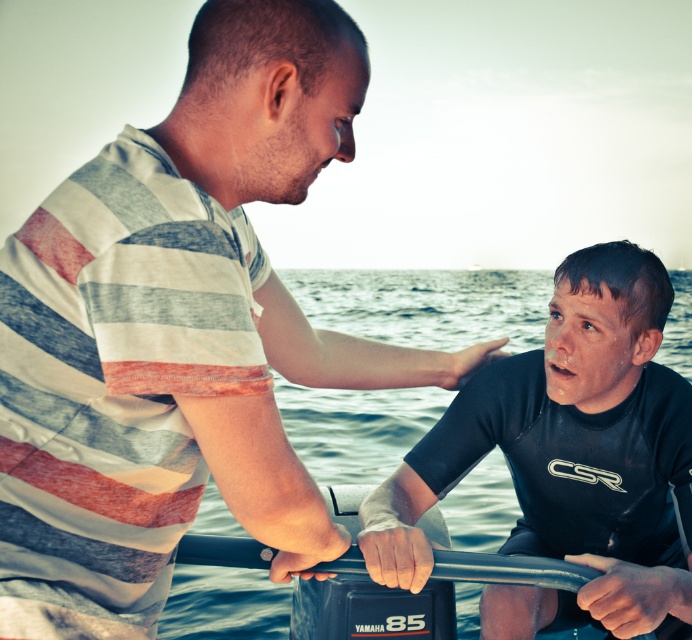
Who is taller, striped cotton shirt at upper left or clear blue water at lower center?

clear blue water at lower center

You are a GUI agent. You are given a task and a screenshot of the screen. Output one action in this format:
    pyautogui.click(x=<x>, y=<y>)
    Task: Click on the striped cotton shirt at upper left
    The image size is (692, 640).
    Given the screenshot: What is the action you would take?
    pyautogui.click(x=176, y=332)

Does striped cotton shirt at upper left have a larger size compared to black matte wetsuit at center?

No.

Between striped cotton shirt at upper left and black matte wetsuit at center, which one appears on the right side from the viewer's perspective?

black matte wetsuit at center

Which is behind, point (230, 497) or point (392, 531)?

Positioned behind is point (392, 531).

The height and width of the screenshot is (640, 692). In order to click on striped cotton shirt at upper left in this screenshot , I will do `click(176, 332)`.

Who is lower down, black matte wetsuit at center or clear blue water at lower center?

black matte wetsuit at center is lower down.

Which is more to the left, black matte wetsuit at center or clear blue water at lower center?

Positioned to the left is black matte wetsuit at center.

Describe the element at coordinates (570, 448) in the screenshot. Image resolution: width=692 pixels, height=640 pixels. I see `black matte wetsuit at center` at that location.

This screenshot has width=692, height=640. I want to click on black matte wetsuit at center, so click(x=570, y=448).